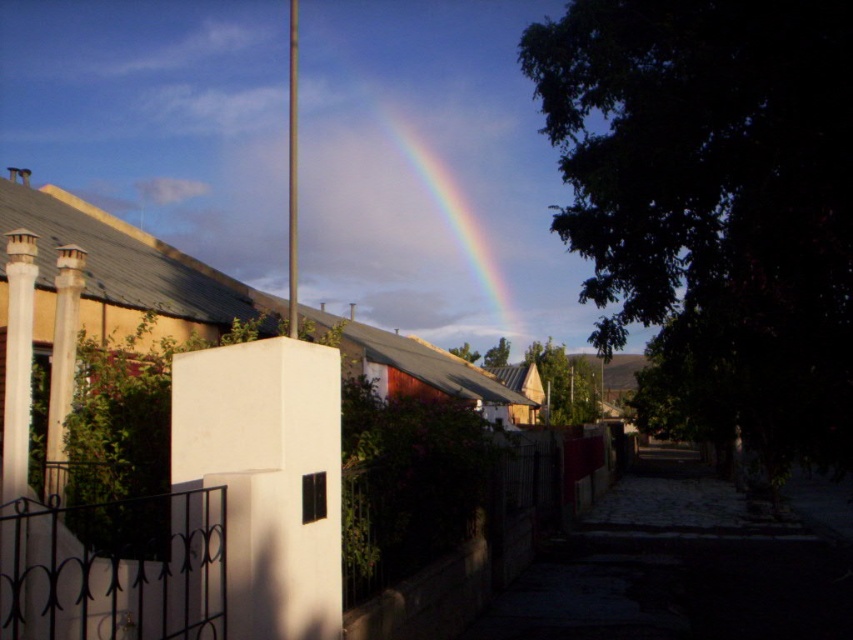
Question: Based on their relative distances, which object is farther from the white concrete pillar at left?

Choices:
 (A) white matte pillar at center
 (B) rainbow at upper center

Answer: (B)

Question: Which point appears farthest from the camera in this image?

Choices:
 (A) (180, 380)
 (B) (57, 260)
 (C) (483, 150)

Answer: (C)

Question: Among these objects, which one is nearest to the camera?

Choices:
 (A) white matte pillar at center
 (B) white concrete pillar at left

Answer: (A)

Question: Is white matte pillar at center closer to the viewer compared to white concrete pillar at left?

Choices:
 (A) yes
 (B) no

Answer: (A)

Question: Is white matte pillar at center positioned in front of white concrete pillar at left?

Choices:
 (A) no
 (B) yes

Answer: (B)

Question: Observing the image, what is the correct spatial positioning of white matte pillar at center in reference to rainbow at upper center?

Choices:
 (A) below
 (B) above

Answer: (A)